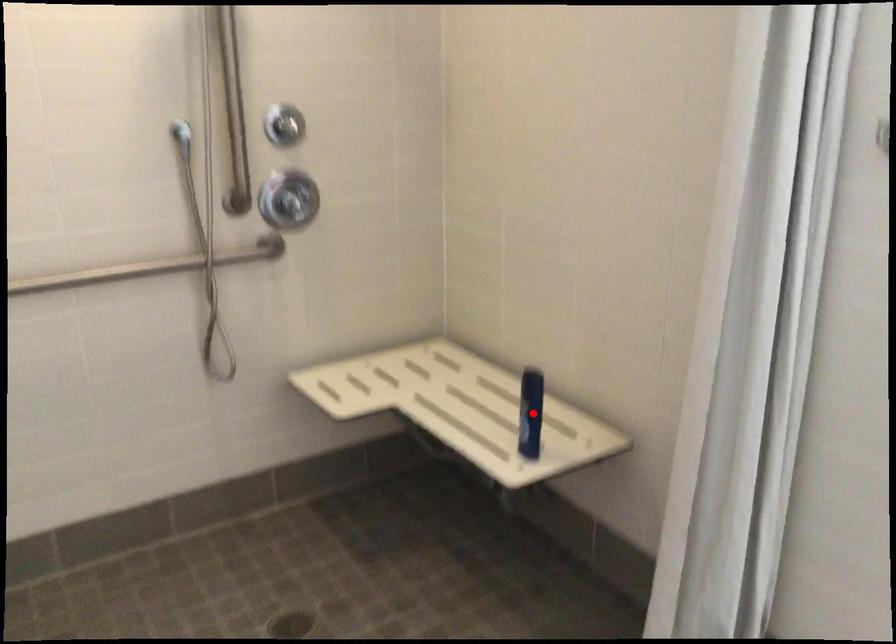
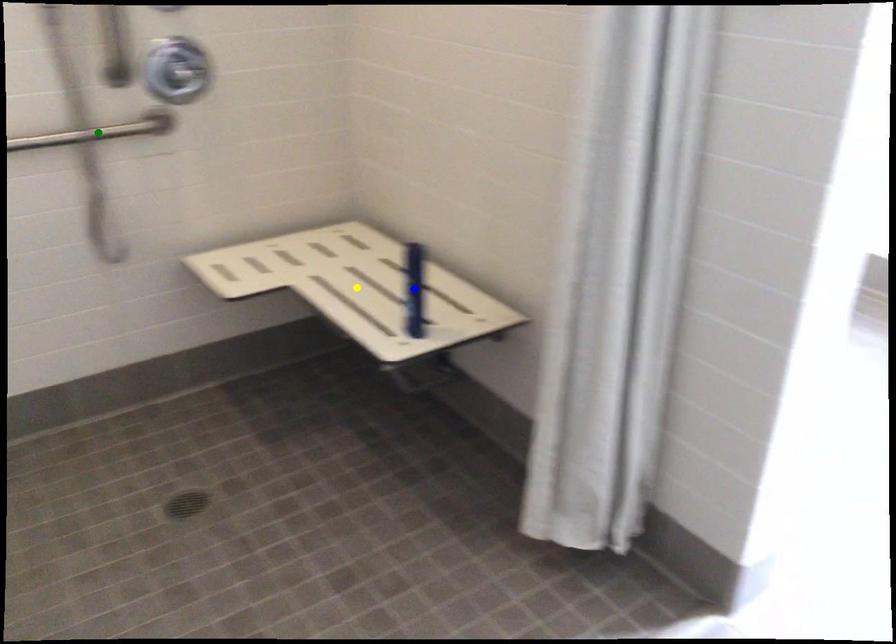
Question: I am providing you with two images of the same scene from different viewpoints. A red point is marked on the first image. You are given multiple points on the second image. In image 2, which mark is for the same physical point as the one in image 1?

Choices:
 (A) yellow point
 (B) green point
 (C) blue point

Answer: (C)